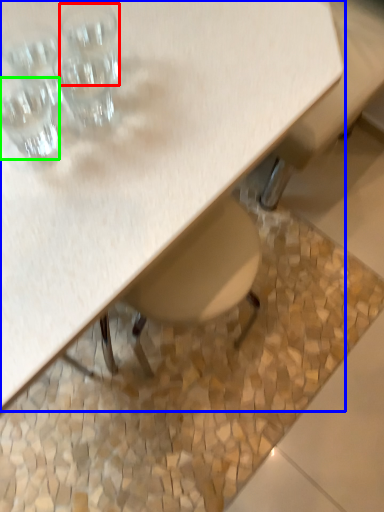
Question: Which object is the farthest from shot glass (highlighted by a red box)? Choose among these: table (highlighted by a blue box) or shot glass (highlighted by a green box).

Choices:
 (A) table
 (B) shot glass

Answer: (A)